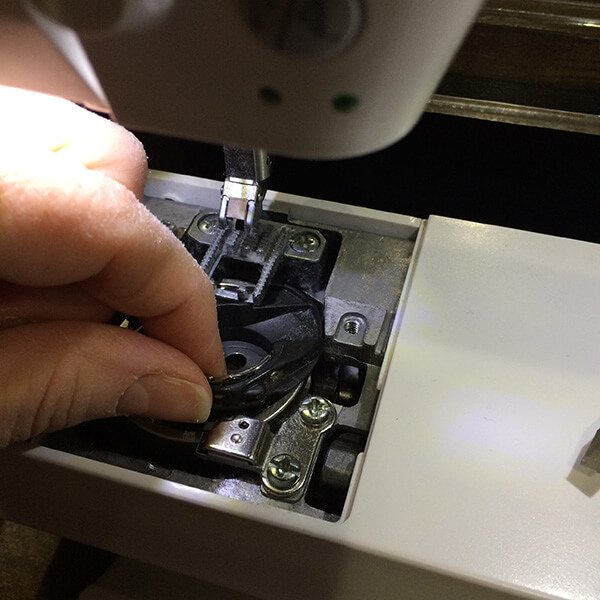
Where can what looks like a clear power cord be observed in this image? Your answer should be formatted as a list of tuples, i.e. [(x1, y1), (x2, y2), ...], where each tuple contains the x and y coordinates of a point satisfying the conditions above.

[(507, 117), (580, 25)]